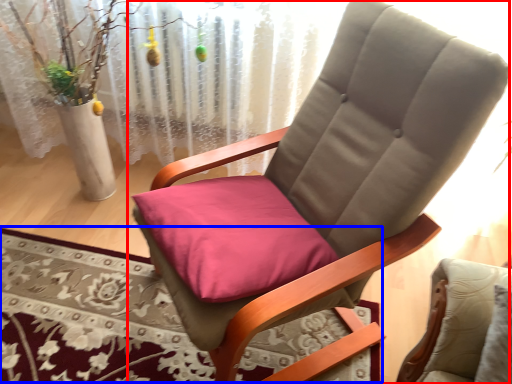
Question: Among these objects, which one is nearest to the camera, chair (highlighted by a red box) or mat (highlighted by a blue box)?

Choices:
 (A) chair
 (B) mat

Answer: (A)